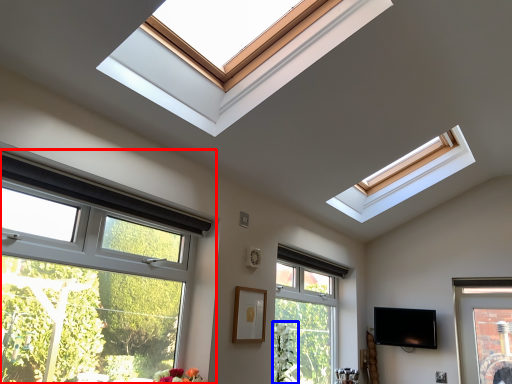
Question: Which of the following is the closest to the observer, window (highlighted by a red box) or plant (highlighted by a blue box)?

Choices:
 (A) window
 (B) plant

Answer: (A)